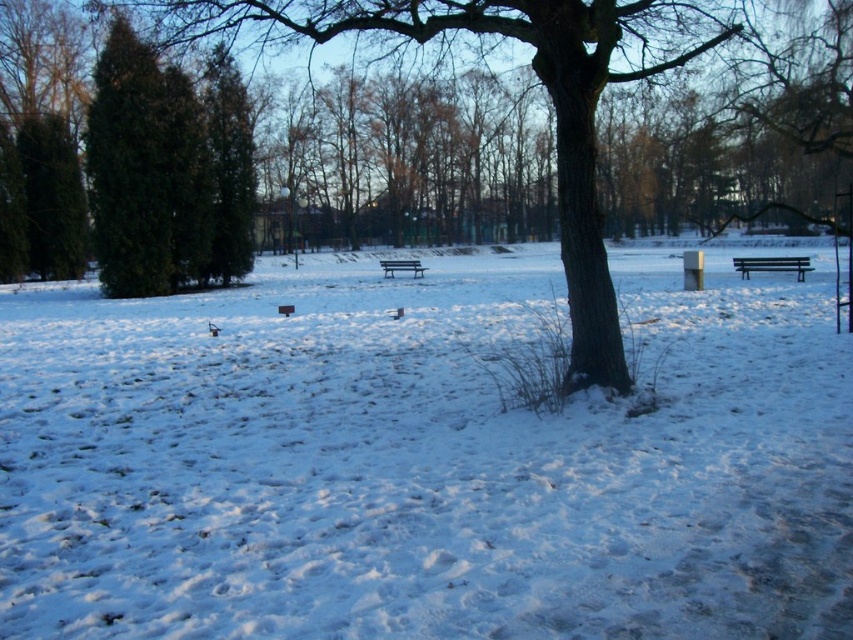
Question: Is brown rough tree trunk at center to the left of wooden bench at center from the viewer's perspective?

Choices:
 (A) no
 (B) yes

Answer: (B)

Question: Is the position of white fluffy snow at center more distant than that of wooden bench at center?

Choices:
 (A) no
 (B) yes

Answer: (A)

Question: Among these objects, which one is farthest from the camera?

Choices:
 (A) wooden bench at right
 (B) white fluffy snow at center
 (C) brown rough tree trunk at center

Answer: (A)

Question: Which point is closer to the camera?

Choices:
 (A) wooden bench at center
 (B) wooden bench at right
 (C) white fluffy snow at center

Answer: (C)

Question: Among these objects, which one is nearest to the camera?

Choices:
 (A) wooden bench at center
 (B) wooden bench at right

Answer: (B)

Question: Can you confirm if white fluffy snow at center is thinner than brown rough tree trunk at center?

Choices:
 (A) yes
 (B) no

Answer: (B)